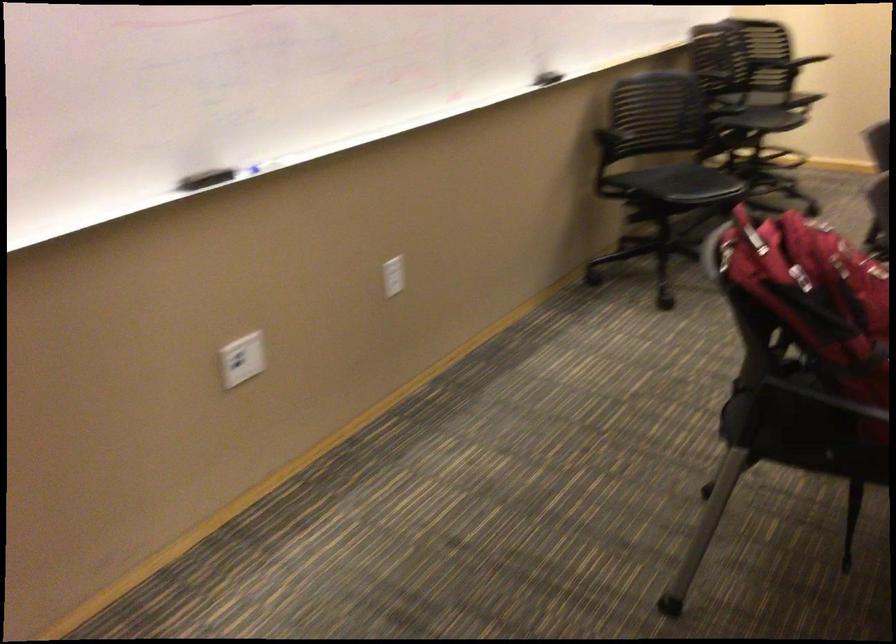
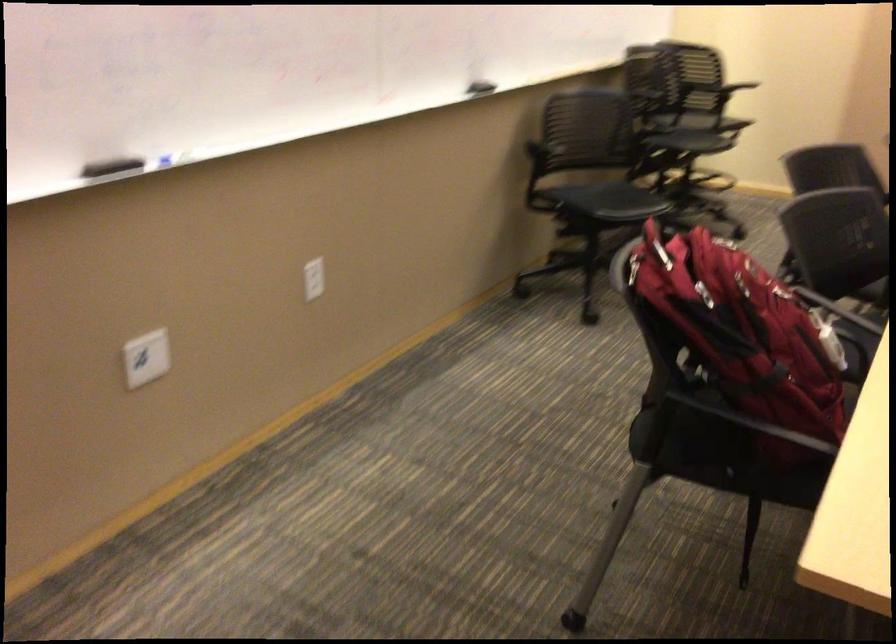
Question: What movement of the cameraman would produce the second image?

Choices:
 (A) Left
 (B) Right
 (C) Forward
 (D) Backward

Answer: (C)